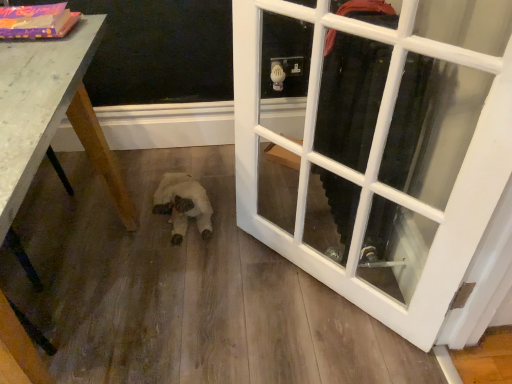
Question: Is wooden table at lower left further to the viewer compared to white plush toy at center?

Choices:
 (A) no
 (B) yes

Answer: (A)

Question: Are wooden table at lower left and white plush toy at center located far from each other?

Choices:
 (A) yes
 (B) no

Answer: (B)

Question: Does wooden table at lower left have a lesser height compared to white plush toy at center?

Choices:
 (A) yes
 (B) no

Answer: (B)

Question: Does wooden table at lower left have a larger size compared to white plush toy at center?

Choices:
 (A) no
 (B) yes

Answer: (B)

Question: Is wooden table at lower left oriented away from white plush toy at center?

Choices:
 (A) yes
 (B) no

Answer: (B)

Question: Considering the relative positions of wooden table at lower left and white glass door at center in the image provided, is wooden table at lower left to the left or to the right of white glass door at center?

Choices:
 (A) right
 (B) left

Answer: (B)

Question: Is wooden table at lower left wider or thinner than white glass door at center?

Choices:
 (A) wide
 (B) thin

Answer: (A)

Question: In the image, is wooden table at lower left positioned in front of or behind white glass door at center?

Choices:
 (A) front
 (B) behind

Answer: (A)

Question: Based on their sizes in the image, would you say wooden table at lower left is bigger or smaller than white glass door at center?

Choices:
 (A) small
 (B) big

Answer: (B)

Question: From a real-world perspective, is white glass door at center positioned above or below wooden table at lower left?

Choices:
 (A) above
 (B) below

Answer: (A)

Question: Is white glass door at center taller or shorter than wooden table at lower left?

Choices:
 (A) short
 (B) tall

Answer: (B)

Question: Is white glass door at center spatially inside wooden table at lower left, or outside of it?

Choices:
 (A) inside
 (B) outside

Answer: (B)

Question: Based on their sizes in the image, would you say white glass door at center is bigger or smaller than wooden table at lower left?

Choices:
 (A) big
 (B) small

Answer: (B)

Question: Is point (173, 243) closer or farther from the camera than point (333, 228)?

Choices:
 (A) farther
 (B) closer

Answer: (B)

Question: Considering the positions of white plush toy at center and white glass door at center in the image, is white plush toy at center wider or thinner than white glass door at center?

Choices:
 (A) wide
 (B) thin

Answer: (A)